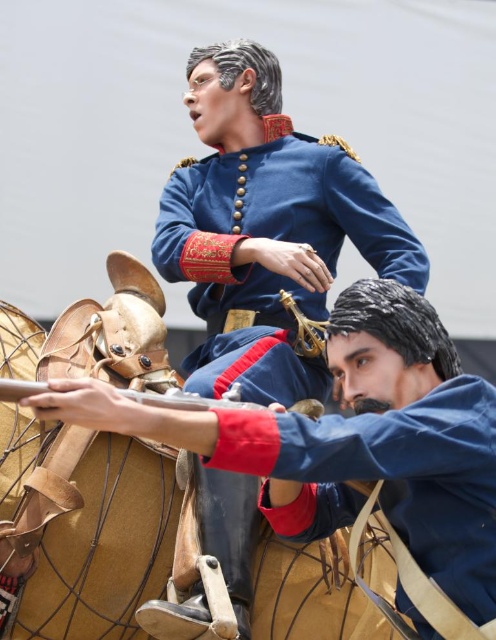
Question: Which point is closer to the camera?

Choices:
 (A) matte blue uniform at center
 (B) blue satin uniform at center

Answer: (A)

Question: Does matte blue uniform at center appear under metallic gun at center?

Choices:
 (A) yes
 (B) no

Answer: (A)

Question: Which of the following is the farthest from the observer?

Choices:
 (A) blue satin uniform at center
 (B) metallic gun at center
 (C) matte blue uniform at center

Answer: (A)

Question: From the image, what is the correct spatial relationship of matte blue uniform at center in relation to metallic gun at center?

Choices:
 (A) left
 (B) right

Answer: (B)

Question: Which of these objects is positioned farthest from the metallic gun at center?

Choices:
 (A) blue satin uniform at center
 (B) matte blue uniform at center

Answer: (A)

Question: Does matte blue uniform at center have a larger size compared to blue satin uniform at center?

Choices:
 (A) yes
 (B) no

Answer: (B)